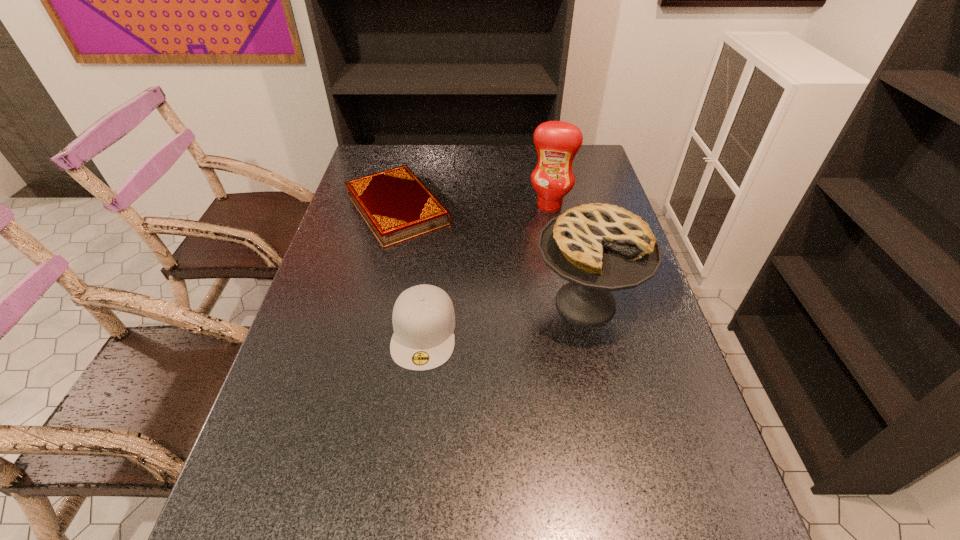
Find the location of a particular element. The height and width of the screenshot is (540, 960). free space on the desktop that is between the second shortest object and the pie and is positioned on the cover of the hardback book is located at coordinates (486, 321).

Identify the location of free space on the desktop that is between the cap and the pie and is positioned on the label side of the condiment. The height and width of the screenshot is (540, 960). (519, 315).